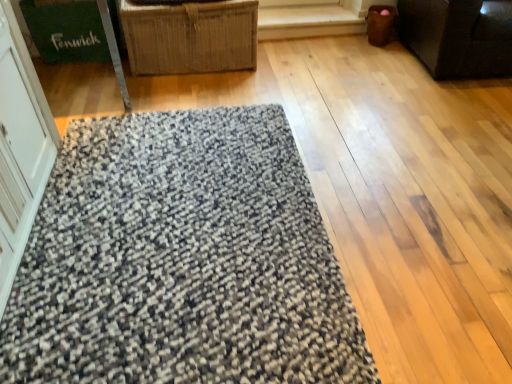
The width and height of the screenshot is (512, 384). I want to click on free spot above textured gray mat at center (from a real-world perspective), so click(166, 221).